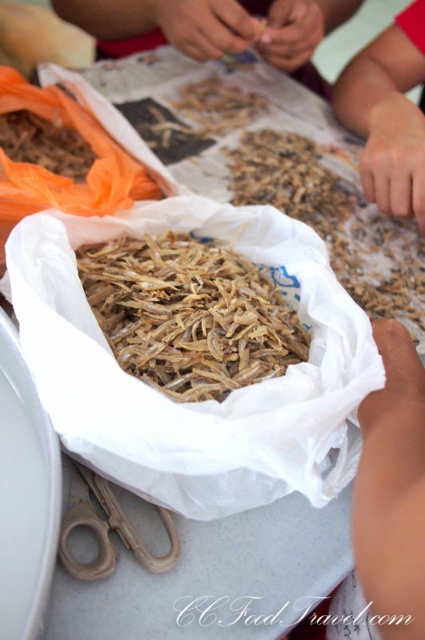
You are an inspector checking the placement of items in a seafood market. The coordinates given are in a normalized system where the bottom left corner is the origin. Where is the brown matte dried shrimp at center located in terms of its 2D coordinates?

The brown matte dried shrimp at center is located at the 2D coordinates of point (x=334, y=220).

You are a customer at a seafood market and see the brown matte dried shrimp at center and the brown wooden scissors at lower left. Which item is positioned higher in the image?

The brown matte dried shrimp at center is positioned higher than the brown wooden scissors at lower left in the image.

You are a food inspector checking the packaging of the brown crispy snack at center. Your tool can only reach items within 26 inches. Can you safely inspect it?

The brown crispy snack at center is 27.03 inches away from the camera, which is beyond the tool reach of 26 inches. Therefore, the inspector cannot safely inspect it.